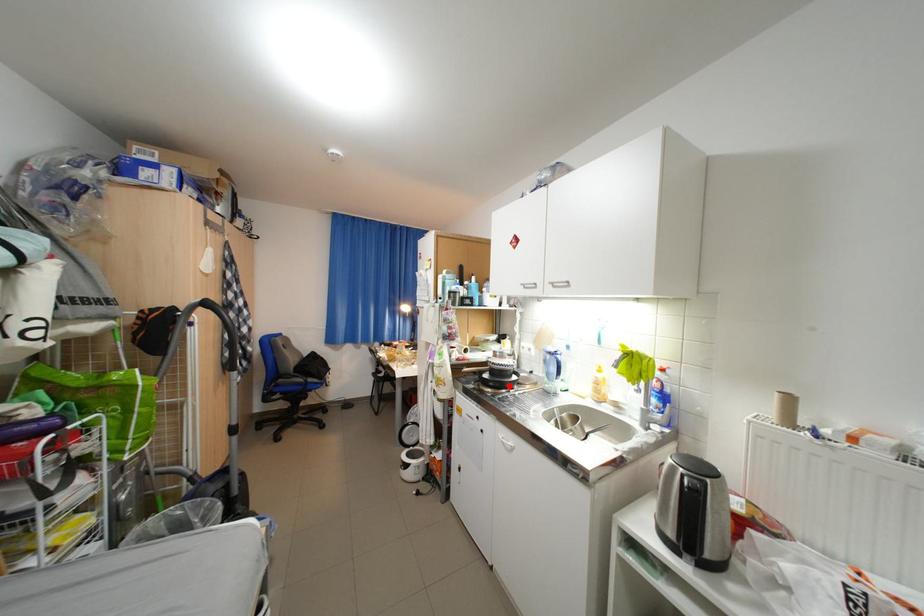
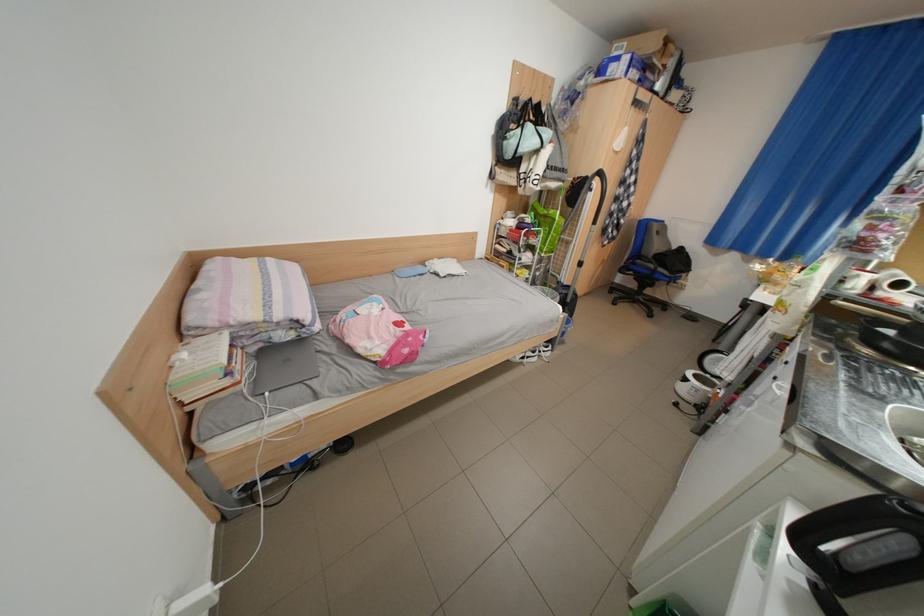
In the second image, find the point that corresponds to the highlighted location in the first image.

(900, 347)